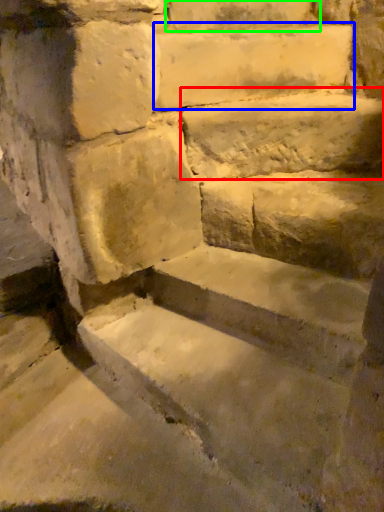
Question: Which is nearer to the limestone (highlighted by a red box)? limestone (highlighted by a blue box) or brick (highlighted by a green box).

Choices:
 (A) limestone
 (B) brick

Answer: (A)